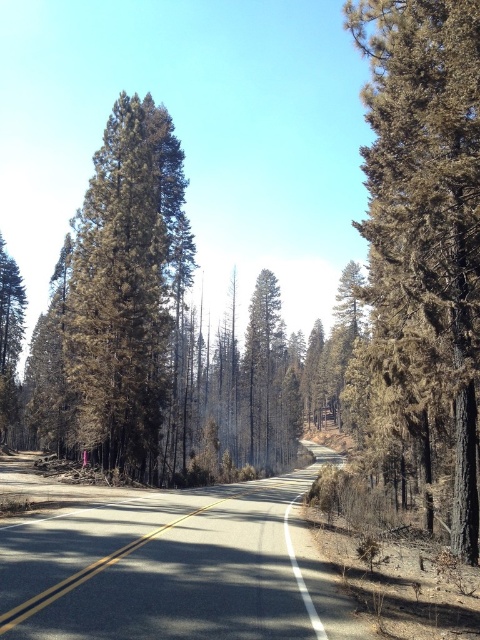
Looking at this image, you are a hiker standing at the starting point of the road. You want to reach the charred bark tree at center. Which direction should you walk to get there?

The charred bark tree at center is located at point [425,212], so you should walk towards the center of the road to reach it.

In the scene shown: You are a hiker standing on the asphalt road at center. You notice a brown textured tree at center above you. Which direction should you walk to get out from under the tree?

The asphalt road at center is positioned under the brown textured tree at center, so walking forward or backward along the road will keep you under the tree. To exit from under the tree, you should walk sideways away from the tree towards either the left or right side of the road.

You are driving a car and see the asphalt road at center and the brown textured tree at center. Which one is closer to you?

The asphalt road at center is closer to you because it is in front of the brown textured tree at center.